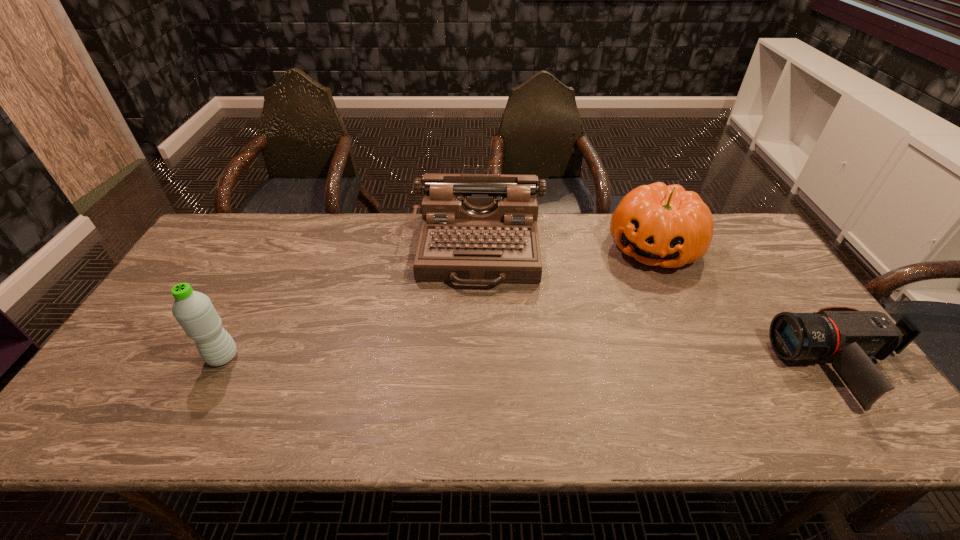
The image size is (960, 540). In order to click on free space located 0.180m on the keyboard of the second object from left to right in this screenshot , I will do `click(475, 342)`.

This screenshot has width=960, height=540. Find the location of `free region located 0.080m on the keyboard of the second object from left to right`. free region located 0.080m on the keyboard of the second object from left to right is located at coordinates (476, 313).

What are the coordinates of `blank area located 0.240m on the carved face of the second object from right to left` in the screenshot? It's located at (614, 327).

The height and width of the screenshot is (540, 960). Find the location of `vacant point located on the carved face of the second object from right to left`. vacant point located on the carved face of the second object from right to left is located at coordinates (610, 337).

At what (x,y) coordinates should I click in order to perform the action: click on free space located on the carved face of the second object from right to left. Please return your answer as a coordinate pair (x, y). Looking at the image, I should click on (636, 284).

Locate an element on the screen. The height and width of the screenshot is (540, 960). typewriter that is at the far edge is located at coordinates (478, 229).

This screenshot has height=540, width=960. I want to click on pumpkin present at the far edge, so click(x=657, y=224).

Where is `water bottle that is at the near edge`? The height and width of the screenshot is (540, 960). water bottle that is at the near edge is located at coordinates (194, 311).

At what (x,y) coordinates should I click in order to perform the action: click on camcorder present at the near edge. Please return your answer as a coordinate pair (x, y). Looking at the image, I should click on (851, 339).

Find the location of a particular element. Image resolution: width=960 pixels, height=540 pixels. object that is positioned at the right edge is located at coordinates (851, 339).